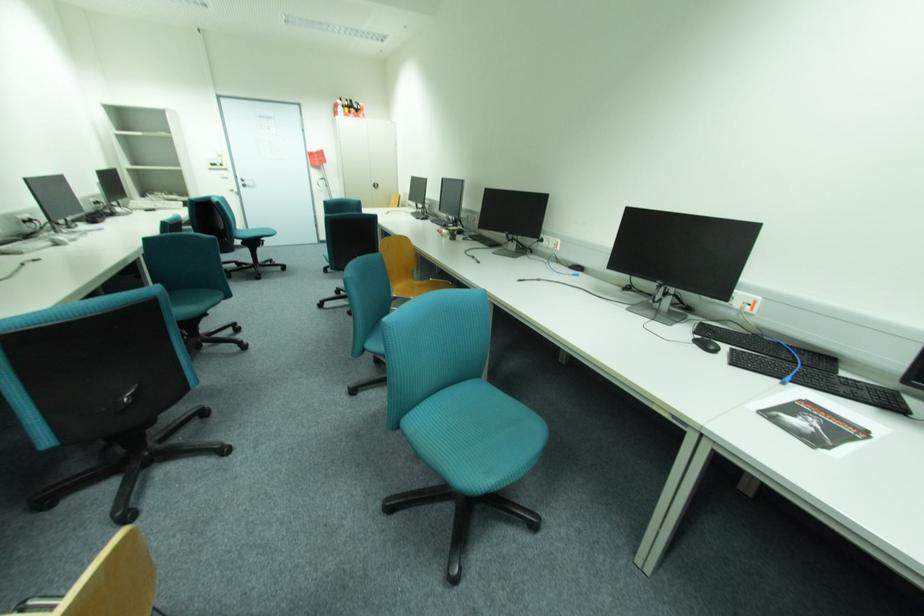
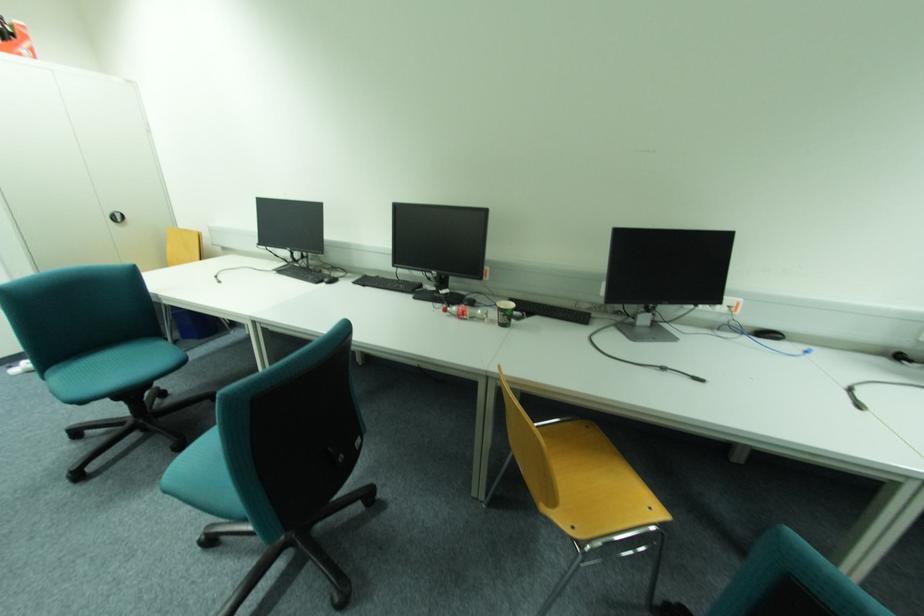
The point at [444,231] is marked in the first image. Where is the corresponding point in the second image?

(451, 310)